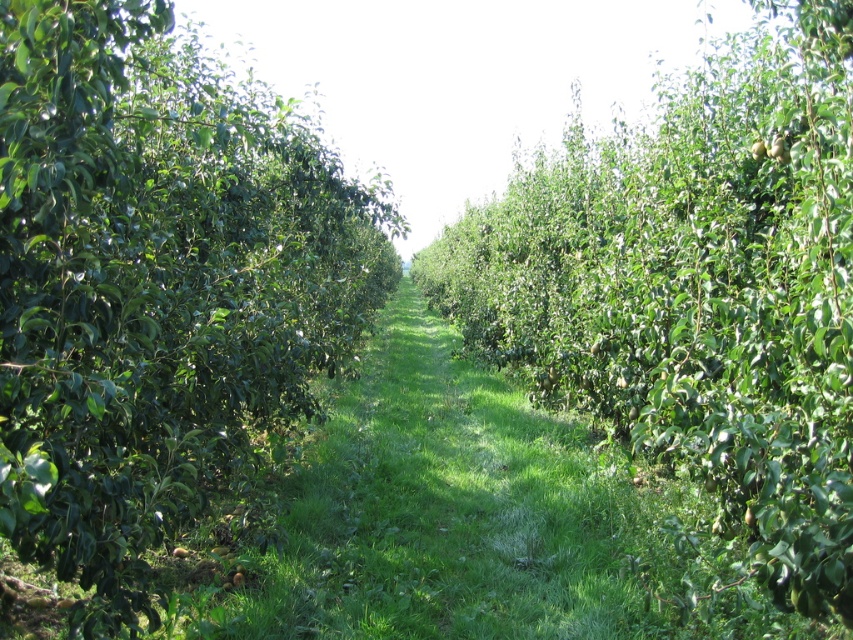
Question: Which of the following is the closest to the observer?

Choices:
 (A) (32, 212)
 (B) (845, 269)

Answer: (A)

Question: Does green glossy tree at left lie behind green grass at center?

Choices:
 (A) yes
 (B) no

Answer: (A)

Question: Is green leafy tree at center above green grass at center?

Choices:
 (A) yes
 (B) no

Answer: (A)

Question: Where is green glossy tree at left located in relation to green grass at center in the image?

Choices:
 (A) below
 (B) above

Answer: (B)

Question: Which point is closer to the camera?

Choices:
 (A) (537, 609)
 (B) (254, 378)

Answer: (A)

Question: Which point is farther from the camera taking this photo?

Choices:
 (A) (532, 532)
 (B) (90, 52)

Answer: (A)